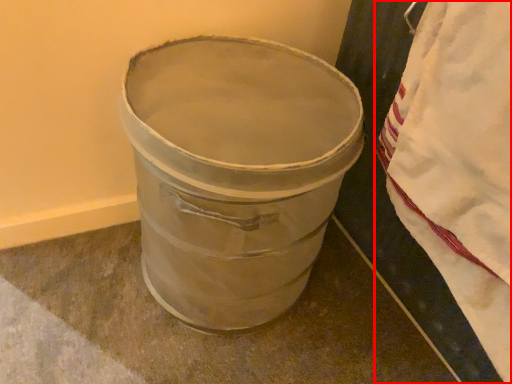
Question: Observing the image, what is the correct spatial positioning of blanket (annotated by the red box) in reference to waste container?

Choices:
 (A) left
 (B) right

Answer: (B)